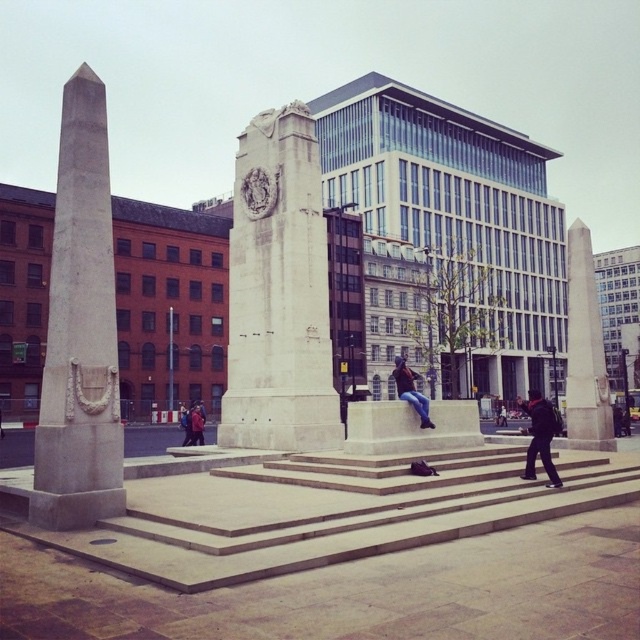
Question: Is the position of white stone monument at center more distant than that of denim jeans at center?

Choices:
 (A) yes
 (B) no

Answer: (A)

Question: Considering the real-world distances, which object is farthest from the white marble obelisk at left?

Choices:
 (A) dark blue jeans at lower right
 (B) red jacket at center

Answer: (A)

Question: Which of the following is the closest to the observer?

Choices:
 (A) (582, 305)
 (B) (74, 193)

Answer: (B)

Question: Which of the following is the farthest from the observer?

Choices:
 (A) dark blue jeans at lower right
 (B) white marble obelisk at right
 (C) denim jeans at center
 (D) white marble obelisk at left

Answer: (B)

Question: Can you confirm if white stone monument at center is smaller than dark blue jeans at lower right?

Choices:
 (A) yes
 (B) no

Answer: (A)

Question: Does white stone monument at center have a lesser width compared to white marble obelisk at right?

Choices:
 (A) no
 (B) yes

Answer: (B)